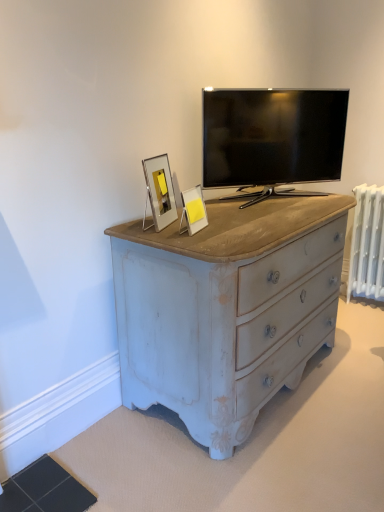
This screenshot has height=512, width=384. Describe the element at coordinates (193, 210) in the screenshot. I see `matte white picture frame at center, which appears as the second picture frame when viewed from the left` at that location.

Where is `black glossy tv at upper center`? The width and height of the screenshot is (384, 512). black glossy tv at upper center is located at coordinates (272, 136).

The height and width of the screenshot is (512, 384). What do you see at coordinates (367, 244) in the screenshot?
I see `white painted metal radiator at right` at bounding box center [367, 244].

Describe the element at coordinates (160, 190) in the screenshot. I see `silver metallic picture frame at upper center, which ranks as the 1th picture frame in left-to-right order` at that location.

You are a GUI agent. You are given a task and a screenshot of the screen. Output one action in this format:
    pyautogui.click(x=<x>, y=<y>)
    Task: Click on the matte white picture frame at center, which appears as the second picture frame when viewed from the left
    
    Given the screenshot: What is the action you would take?
    pyautogui.click(x=193, y=210)

Between point (270, 148) and point (149, 161), which one is positioned in front?

The point (149, 161) is closer to the camera.

Can you confirm if black glossy tv at upper center is bigger than silver metallic picture frame at upper center, the second picture frame from the right?

Yes, black glossy tv at upper center is bigger than silver metallic picture frame at upper center, the second picture frame from the right.

Is the depth of black glossy tv at upper center less than that of silver metallic picture frame at upper center, which ranks as the 1th picture frame in left-to-right order?

No, black glossy tv at upper center is further to the viewer.

Find the location of `television above the silver metallic picture frame at upper center, the second picture frame from the right (from a real-world perspective)`. television above the silver metallic picture frame at upper center, the second picture frame from the right (from a real-world perspective) is located at coordinates (272, 136).

Can you confirm if black glossy tv at upper center is taller than white painted metal radiator at right?

Incorrect, the height of black glossy tv at upper center is not larger of that of white painted metal radiator at right.

Is black glossy tv at upper center oriented away from white painted metal radiator at right?

No.

In terms of width, does black glossy tv at upper center look wider or thinner when compared to white painted metal radiator at right?

Clearly, black glossy tv at upper center has more width compared to white painted metal radiator at right.

Does black glossy tv at upper center come behind white painted metal radiator at right?

No, black glossy tv at upper center is closer to the viewer.

From a real-world perspective, between silver metallic picture frame at upper center, the second picture frame from the right, and black glossy tv at upper center, who is vertically lower?

silver metallic picture frame at upper center, the second picture frame from the right, from a real-world perspective.

Which object is thinner, silver metallic picture frame at upper center, which ranks as the 1th picture frame in left-to-right order, or black glossy tv at upper center?

silver metallic picture frame at upper center, which ranks as the 1th picture frame in left-to-right order, is thinner.

Does point (167, 199) appear closer or farther from the camera than point (300, 155)?

Clearly, point (167, 199) is closer to the camera than point (300, 155).

What's the angular difference between silver metallic picture frame at upper center, which ranks as the 1th picture frame in left-to-right order, and black glossy tv at upper center's facing directions?

The facing directions of silver metallic picture frame at upper center, which ranks as the 1th picture frame in left-to-right order, and black glossy tv at upper center are 55.9 degrees apart.

Does matte white picture frame at center, the first picture frame when ordered from right to left, come in front of silver metallic picture frame at upper center, which ranks as the 1th picture frame in left-to-right order?

That is True.

Is matte white picture frame at center, the first picture frame when ordered from right to left, not within silver metallic picture frame at upper center, the second picture frame from the right?

Indeed, matte white picture frame at center, the first picture frame when ordered from right to left, is completely outside silver metallic picture frame at upper center, the second picture frame from the right.

Can you confirm if matte white picture frame at center, the first picture frame when ordered from right to left, is positioned to the right of silver metallic picture frame at upper center, the second picture frame from the right?

Yes, matte white picture frame at center, the first picture frame when ordered from right to left, is to the right of silver metallic picture frame at upper center, the second picture frame from the right.

From the image's perspective, is white painted metal radiator at right over matte white picture frame at center, which appears as the second picture frame when viewed from the left?

No, from the image's perspective, white painted metal radiator at right is not over matte white picture frame at center, which appears as the second picture frame when viewed from the left.

From the picture: Do you think white painted metal radiator at right is within matte white picture frame at center, the first picture frame when ordered from right to left, or outside of it?

The correct answer is: outside.

Consider the image. Is white painted metal radiator at right facing away from matte white picture frame at center, the first picture frame when ordered from right to left?

white painted metal radiator at right is not turned away from matte white picture frame at center, the first picture frame when ordered from right to left.

Does silver metallic picture frame at upper center, which ranks as the 1th picture frame in left-to-right order, come behind matte white picture frame at center, the first picture frame when ordered from right to left?

Yes, silver metallic picture frame at upper center, which ranks as the 1th picture frame in left-to-right order, is further from the viewer.

Which of these two, silver metallic picture frame at upper center, the second picture frame from the right, or matte white picture frame at center, which appears as the second picture frame when viewed from the left, is wider?

Wider between the two is silver metallic picture frame at upper center, the second picture frame from the right.

Can you confirm if silver metallic picture frame at upper center, the second picture frame from the right, is shorter than matte white picture frame at center, the first picture frame when ordered from right to left?

Incorrect, the height of silver metallic picture frame at upper center, the second picture frame from the right, does not fall short of that of matte white picture frame at center, the first picture frame when ordered from right to left.

Is silver metallic picture frame at upper center, the second picture frame from the right, directly adjacent to matte white picture frame at center, the first picture frame when ordered from right to left?

There is a gap between silver metallic picture frame at upper center, the second picture frame from the right, and matte white picture frame at center, the first picture frame when ordered from right to left.

In the scene shown: Is white painted metal radiator at right at the back of matte white picture frame at center, which appears as the second picture frame when viewed from the left?

No, matte white picture frame at center, which appears as the second picture frame when viewed from the left,'s orientation is not away from white painted metal radiator at right.

Considering the sizes of objects matte white picture frame at center, the first picture frame when ordered from right to left, and white painted metal radiator at right in the image provided, who is bigger, matte white picture frame at center, the first picture frame when ordered from right to left, or white painted metal radiator at right?

white painted metal radiator at right is bigger.

Considering their positions, is matte white picture frame at center, which appears as the second picture frame when viewed from the left, located in front of or behind white painted metal radiator at right?

matte white picture frame at center, which appears as the second picture frame when viewed from the left, is in front of white painted metal radiator at right.

Between matte white picture frame at center, the first picture frame when ordered from right to left, and white painted metal radiator at right, which one has more height?

Standing taller between the two is white painted metal radiator at right.

Identify the location of television positioned vertically above the silver metallic picture frame at upper center, which ranks as the 1th picture frame in left-to-right order (from a real-world perspective). Image resolution: width=384 pixels, height=512 pixels. (272, 136).

This screenshot has height=512, width=384. Identify the location of television in front of the white painted metal radiator at right. (272, 136).

Which object lies further to the anchor point white painted metal radiator at right, black glossy tv at upper center or matte white picture frame at center, which appears as the second picture frame when viewed from the left?

matte white picture frame at center, which appears as the second picture frame when viewed from the left, lies further to white painted metal radiator at right than the other object.

Based on their spatial positions, is matte white picture frame at center, the first picture frame when ordered from right to left, or black glossy tv at upper center closer to white painted metal radiator at right?

black glossy tv at upper center is positioned closer to the anchor white painted metal radiator at right.

From the image, which object appears to be farther from matte white picture frame at center, the first picture frame when ordered from right to left, silver metallic picture frame at upper center, the second picture frame from the right, or white painted metal radiator at right?

white painted metal radiator at right.

Based on the photo, considering their positions, is silver metallic picture frame at upper center, which ranks as the 1th picture frame in left-to-right order, positioned further to white painted metal radiator at right than black glossy tv at upper center?

silver metallic picture frame at upper center, which ranks as the 1th picture frame in left-to-right order, is further to white painted metal radiator at right.

Which object lies further to the anchor point silver metallic picture frame at upper center, which ranks as the 1th picture frame in left-to-right order, white painted metal radiator at right or matte white picture frame at center, the first picture frame when ordered from right to left?

The object further to silver metallic picture frame at upper center, which ranks as the 1th picture frame in left-to-right order, is white painted metal radiator at right.

Estimate the real-world distances between objects in this image. Which object is further from black glossy tv at upper center, matte white picture frame at center, the first picture frame when ordered from right to left, or white painted metal radiator at right?

Based on the image, white painted metal radiator at right appears to be further to black glossy tv at upper center.

From the image, which object appears to be nearer to black glossy tv at upper center, silver metallic picture frame at upper center, the second picture frame from the right, or white painted metal radiator at right?

Based on the image, silver metallic picture frame at upper center, the second picture frame from the right, appears to be nearer to black glossy tv at upper center.

From the image, which object appears to be nearer to black glossy tv at upper center, white painted metal radiator at right or silver metallic picture frame at upper center, which ranks as the 1th picture frame in left-to-right order?

silver metallic picture frame at upper center, which ranks as the 1th picture frame in left-to-right order.

Find the location of a particular element. picture frame located between silver metallic picture frame at upper center, the second picture frame from the right, and white painted metal radiator at right in the left-right direction is located at coordinates (193, 210).

Locate an element on the screen. television between matte white picture frame at center, the first picture frame when ordered from right to left, and white painted metal radiator at right, in the horizontal direction is located at coordinates (272, 136).

Locate an element on the screen. This screenshot has height=512, width=384. picture frame situated between silver metallic picture frame at upper center, which ranks as the 1th picture frame in left-to-right order, and black glossy tv at upper center from left to right is located at coordinates (193, 210).

Locate an element on the screen. This screenshot has width=384, height=512. television between silver metallic picture frame at upper center, which ranks as the 1th picture frame in left-to-right order, and white painted metal radiator at right, in the horizontal direction is located at coordinates (272, 136).